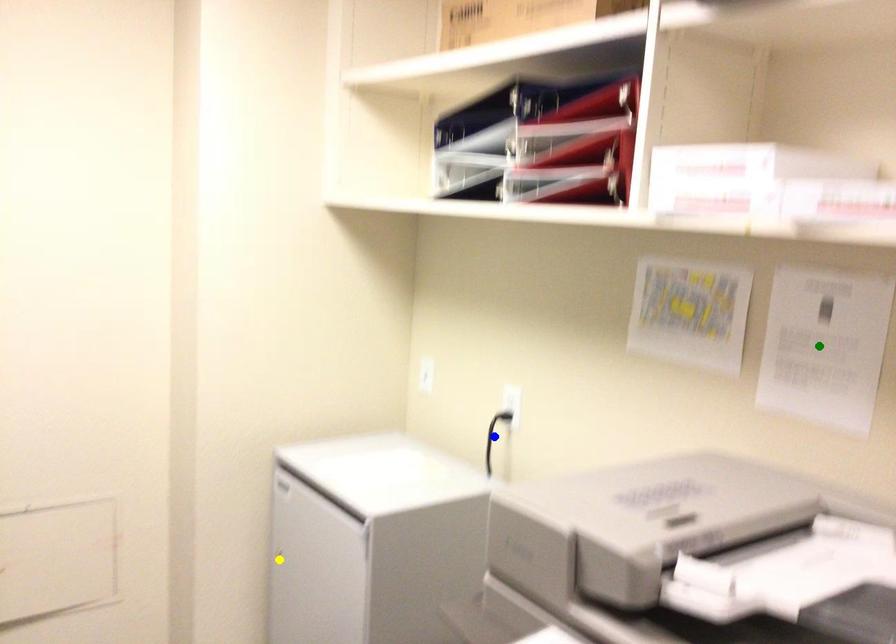
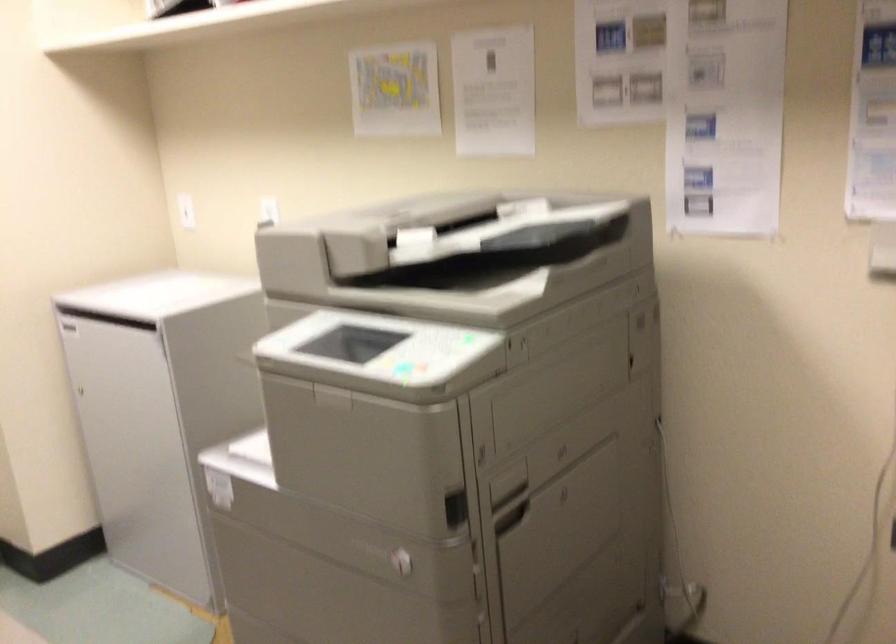
I am providing you with two images of the same scene from different viewpoints. Three points are marked in image1. Which point corresponds to a part or object that is occluded in image2?In image1, three points are marked. Which of them correspond to a part or object that is occluded in image2?Among the three points shown in image1, which one corresponds to a part or object that is no longer visible due to occlusion in image2?

Invisible in image2: blue point.